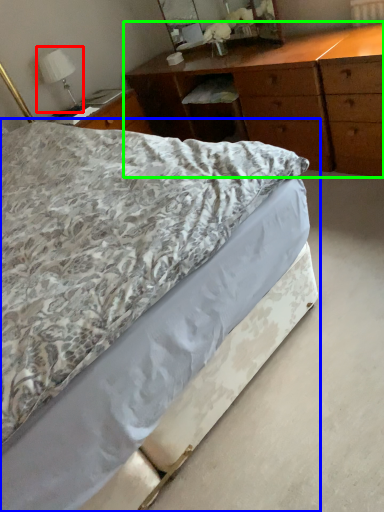
Question: Estimate the real-world distances between objects in this image. Which object is farther from bedside lamp (highlighted by a red box), bed (highlighted by a blue box) or chest of drawers (highlighted by a green box)?

Choices:
 (A) bed
 (B) chest of drawers

Answer: (A)